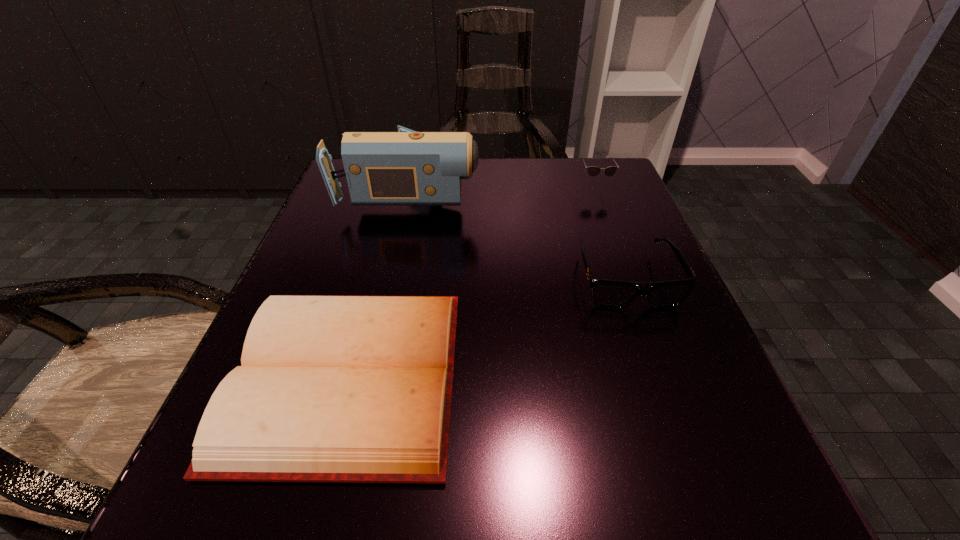
Where is `vacant space at the right edge of the desktop`? vacant space at the right edge of the desktop is located at coordinates (588, 252).

Image resolution: width=960 pixels, height=540 pixels. In the image, there is a desktop. Identify the location of free space at the near left corner. (258, 510).

Locate an element on the screen. The height and width of the screenshot is (540, 960). blank space at the far right corner of the desktop is located at coordinates (572, 187).

The image size is (960, 540). What are the coordinates of `vacant space that is in between the camcorder and the taller sunglasses` in the screenshot? It's located at (503, 188).

Locate an element on the screen. Image resolution: width=960 pixels, height=540 pixels. free space that is in between the shorter sunglasses and the Bible is located at coordinates (487, 328).

The height and width of the screenshot is (540, 960). I want to click on vacant space in between the taller sunglasses and the camcorder, so click(x=503, y=188).

Where is `free space between the tallest object and the third shortest object`? The height and width of the screenshot is (540, 960). free space between the tallest object and the third shortest object is located at coordinates (503, 188).

Find the location of a particular element. The image size is (960, 540). empty space between the Bible and the tallest object is located at coordinates (379, 284).

Locate an element on the screen. blank region between the nearer sunglasses and the Bible is located at coordinates (487, 328).

Where is `free space between the tallest object and the shortest object`? The height and width of the screenshot is (540, 960). free space between the tallest object and the shortest object is located at coordinates (379, 284).